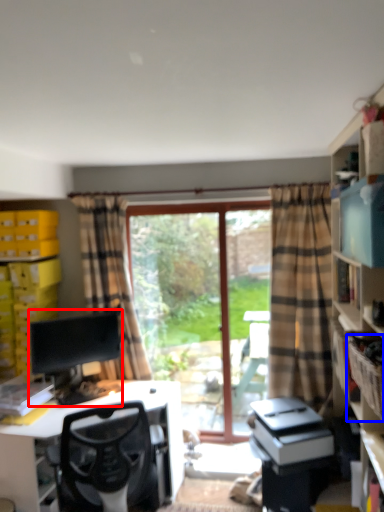
Question: Which object appears farthest to the camera in this image, computer monitor (highlighted by a red box) or crate (highlighted by a blue box)?

Choices:
 (A) computer monitor
 (B) crate

Answer: (A)